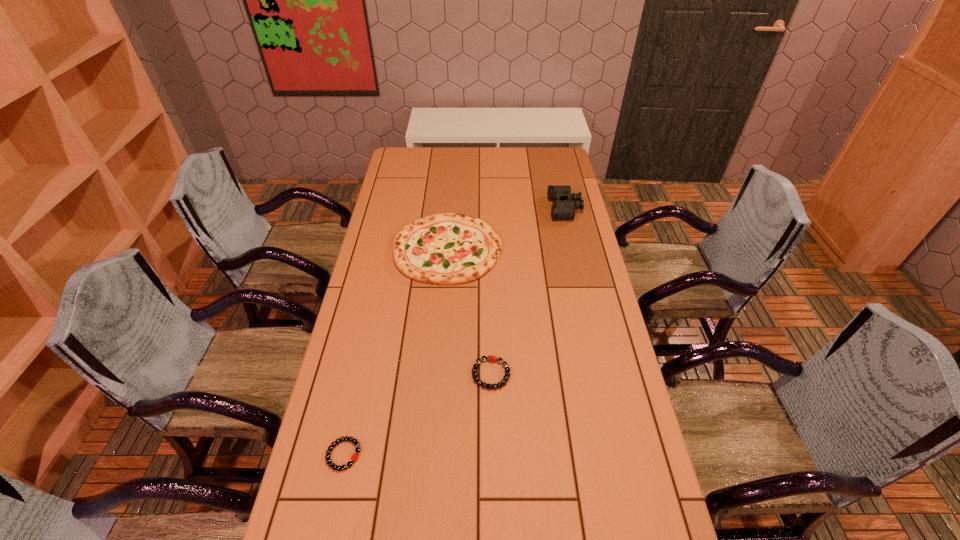
This screenshot has height=540, width=960. In order to click on the rightmost object in this screenshot , I will do `click(565, 203)`.

Identify the location of the tallest object. (565, 203).

Image resolution: width=960 pixels, height=540 pixels. In order to click on the second tallest object in this screenshot , I will do `click(449, 248)`.

Locate an element on the screen. This screenshot has width=960, height=540. the right bracelet is located at coordinates (491, 358).

Identify the location of the third farthest object. (491, 358).

Image resolution: width=960 pixels, height=540 pixels. What are the coordinates of `the shortest object` in the screenshot? It's located at (354, 458).

The height and width of the screenshot is (540, 960). I want to click on the nearest object, so 354,458.

This screenshot has width=960, height=540. I want to click on vacant space situated 0.330m at the eyepieces of the rightmost object, so click(472, 208).

Identify the location of free spot located 0.360m at the eyepieces of the rightmost object. The height and width of the screenshot is (540, 960). (466, 208).

You are a GUI agent. You are given a task and a screenshot of the screen. Output one action in this format:
    pyautogui.click(x=<x>, y=<y>)
    Task: Click on the vacant region located 0.070m at the eyepieces of the rightmost object
    
    Given the screenshot: What is the action you would take?
    pyautogui.click(x=533, y=208)